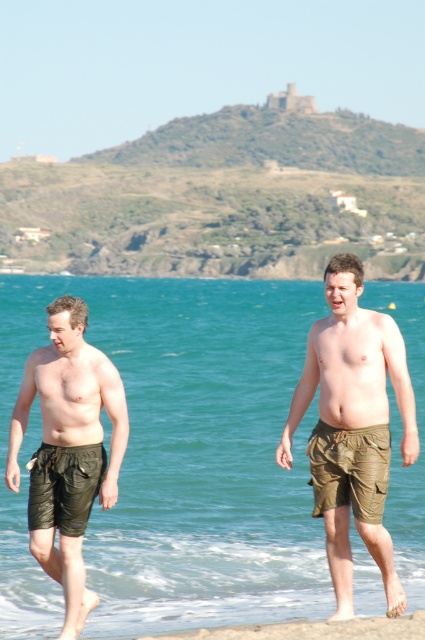
Which is more to the right, green fabric shorts at center or matte khaki shorts at center?

matte khaki shorts at center

Who is more forward, (237, 497) or (339, 557)?

Point (339, 557) is more forward.

Image resolution: width=425 pixels, height=640 pixels. In order to click on green fabric shorts at center in this screenshot , I will do `click(178, 458)`.

You are a GUI agent. You are given a task and a screenshot of the screen. Output one action in this format:
    pyautogui.click(x=<x>, y=<y>)
    Task: Click on the green fabric shorts at center
    
    Given the screenshot: What is the action you would take?
    pyautogui.click(x=178, y=458)

Who is taller, matte olive green swim shorts at left or green leather shorts at lower left?

Standing taller between the two is matte olive green swim shorts at left.

The height and width of the screenshot is (640, 425). In order to click on matte olive green swim shorts at left in this screenshot , I will do `click(68, 449)`.

Can you confirm if green fabric shorts at center is wider than matte olive green swim shorts at left?

Yes, green fabric shorts at center is wider than matte olive green swim shorts at left.

Does green fabric shorts at center have a lesser height compared to matte olive green swim shorts at left?

Incorrect, green fabric shorts at center's height does not fall short of matte olive green swim shorts at left's.

Does point (303, 588) come farther from viewer compared to point (23, 372)?

No, it is not.

The image size is (425, 640). Find the location of `green fabric shorts at center`. green fabric shorts at center is located at coordinates (178, 458).